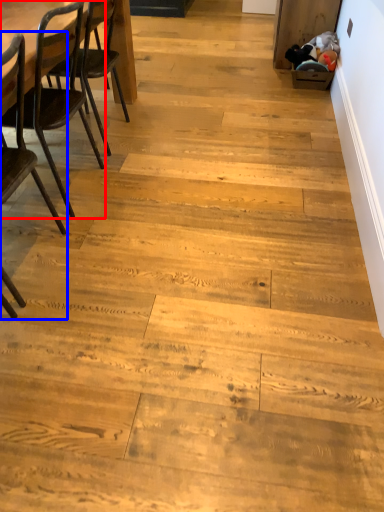
Question: Among these objects, which one is nearest to the camera, chair (highlighted by a red box) or chair (highlighted by a blue box)?

Choices:
 (A) chair
 (B) chair

Answer: (B)